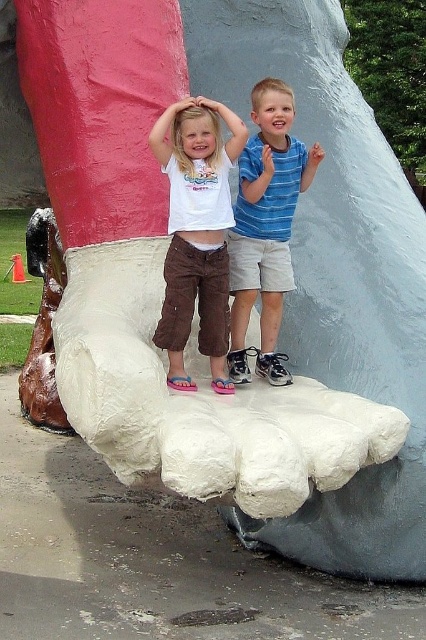
Which is more to the right, matte white shirt at center or blue striped shirt at center?

blue striped shirt at center is more to the right.

Does matte white shirt at center have a lesser width compared to blue striped shirt at center?

Yes, matte white shirt at center is thinner than blue striped shirt at center.

I want to click on matte white shirt at center, so click(x=196, y=230).